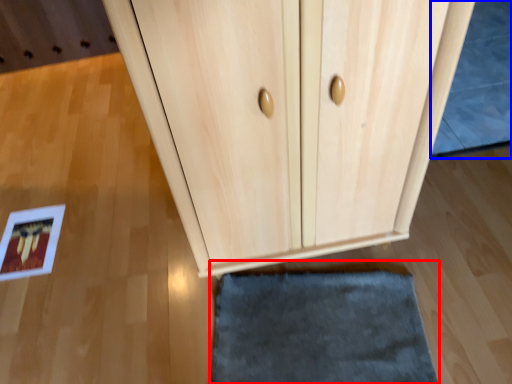
Question: Which object is further to the camera taking this photo, door (highlighted by a red box) or bath mat (highlighted by a blue box)?

Choices:
 (A) door
 (B) bath mat

Answer: (B)